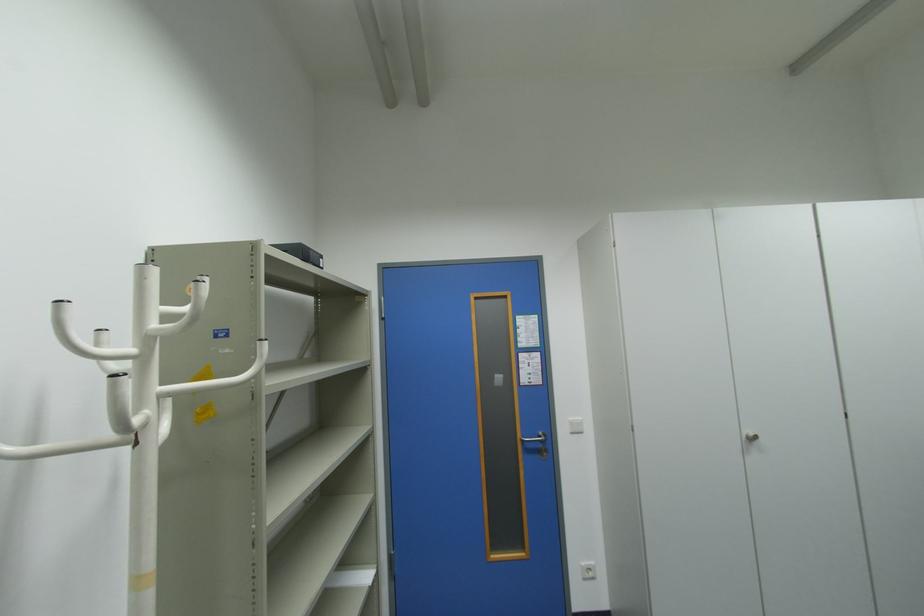
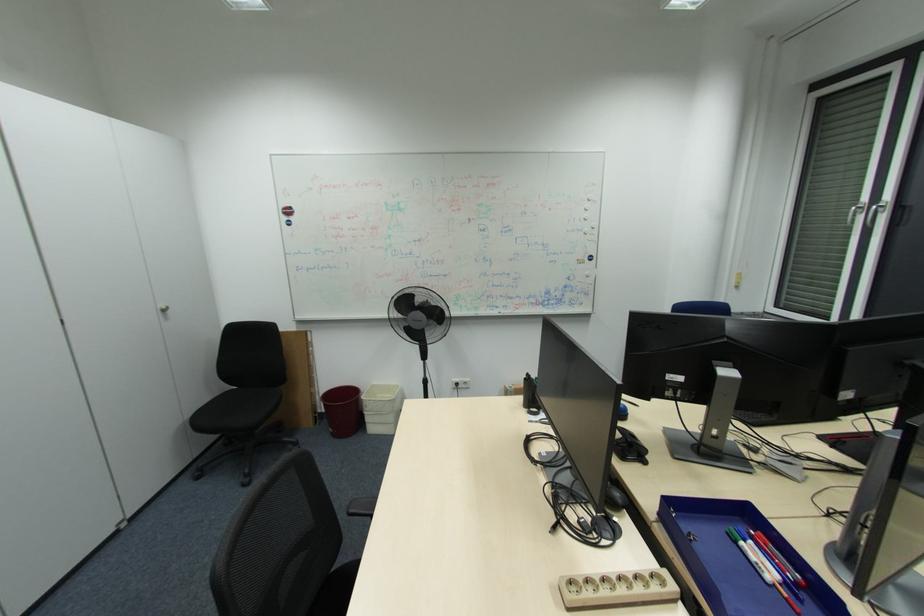
Question: Based on the continuous images, in which direction is the camera rotating? Reply with the corresponding letter.

Choices:
 (A) Left
 (B) Right
 (C) Up
 (D) Down

Answer: (B)